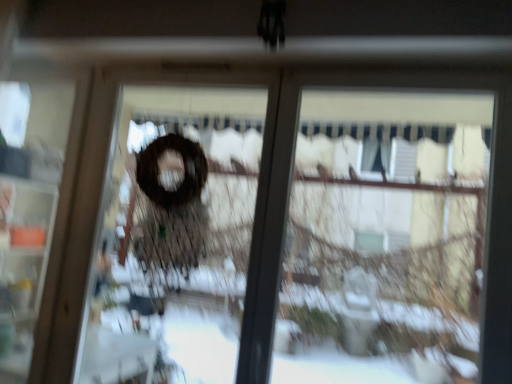
Question: Does transparent plastic screen door at left, the 2th screen door from the right, have a larger size compared to transparent glass at center?

Choices:
 (A) no
 (B) yes

Answer: (A)

Question: Is transparent glass at center at the back of transparent plastic screen door at left, placed as the 1th screen door when sorted from left to right?

Choices:
 (A) no
 (B) yes

Answer: (A)

Question: Is transparent plastic screen door at left, placed as the 1th screen door when sorted from left to right, wider than transparent glass at center?

Choices:
 (A) no
 (B) yes

Answer: (A)

Question: Does transparent plastic screen door at left, placed as the 1th screen door when sorted from left to right, appear on the left side of transparent glass at center?

Choices:
 (A) yes
 (B) no

Answer: (A)

Question: Does transparent plastic screen door at left, the 2th screen door from the right, have a lesser width compared to transparent glass at center?

Choices:
 (A) yes
 (B) no

Answer: (A)

Question: Based on their positions, is transparent plastic screen door at left, the 2th screen door from the right, located to the left or right of brown matte wreath at center, arranged as the 2th screen door when viewed from the left?

Choices:
 (A) left
 (B) right

Answer: (A)

Question: Is transparent plastic screen door at left, placed as the 1th screen door when sorted from left to right, spatially inside brown matte wreath at center, arranged as the 2th screen door when viewed from the left, or outside of it?

Choices:
 (A) inside
 (B) outside

Answer: (B)

Question: In terms of width, does transparent plastic screen door at left, the 2th screen door from the right, look wider or thinner when compared to brown matte wreath at center, marked as the first screen door in a right-to-left arrangement?

Choices:
 (A) wide
 (B) thin

Answer: (A)

Question: In the image, is transparent plastic screen door at left, placed as the 1th screen door when sorted from left to right, positioned in front of or behind brown matte wreath at center, arranged as the 2th screen door when viewed from the left?

Choices:
 (A) front
 (B) behind

Answer: (B)

Question: Considering the positions of transparent glass at center and transparent plastic screen door at left, the 2th screen door from the right, in the image, is transparent glass at center bigger or smaller than transparent plastic screen door at left, the 2th screen door from the right,?

Choices:
 (A) big
 (B) small

Answer: (A)

Question: Considering the positions of point click(x=355, y=175) and point click(x=12, y=188), is point click(x=355, y=175) closer or farther from the camera than point click(x=12, y=188)?

Choices:
 (A) farther
 (B) closer

Answer: (A)

Question: Is transparent glass at center in front of or behind transparent plastic screen door at left, the 2th screen door from the right, in the image?

Choices:
 (A) behind
 (B) front

Answer: (B)

Question: Is transparent glass at center taller or shorter than transparent plastic screen door at left, the 2th screen door from the right?

Choices:
 (A) short
 (B) tall

Answer: (A)

Question: From the image's perspective, is brown matte wreath at center, marked as the first screen door in a right-to-left arrangement, located above or below transparent glass at center?

Choices:
 (A) below
 (B) above

Answer: (A)

Question: From a real-world perspective, is brown matte wreath at center, marked as the first screen door in a right-to-left arrangement, physically located above or below transparent glass at center?

Choices:
 (A) below
 (B) above

Answer: (A)